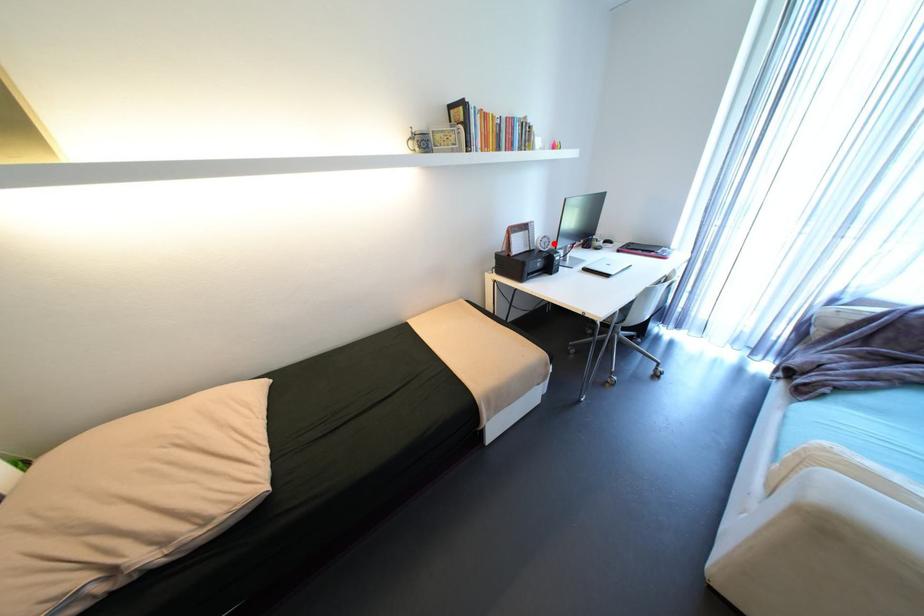
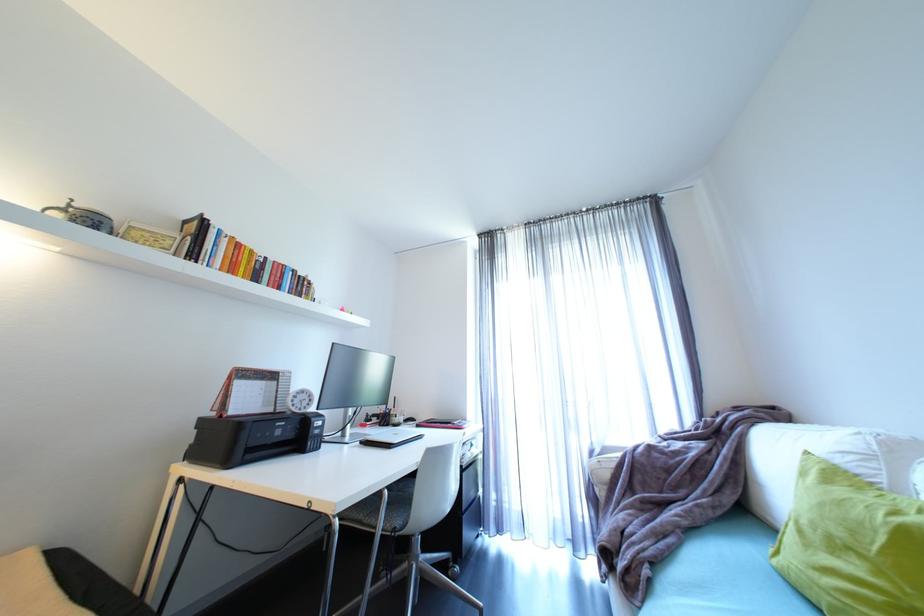
The point at the highlighted location is marked in the first image. Where is the corresponding point in the second image?

(312, 402)